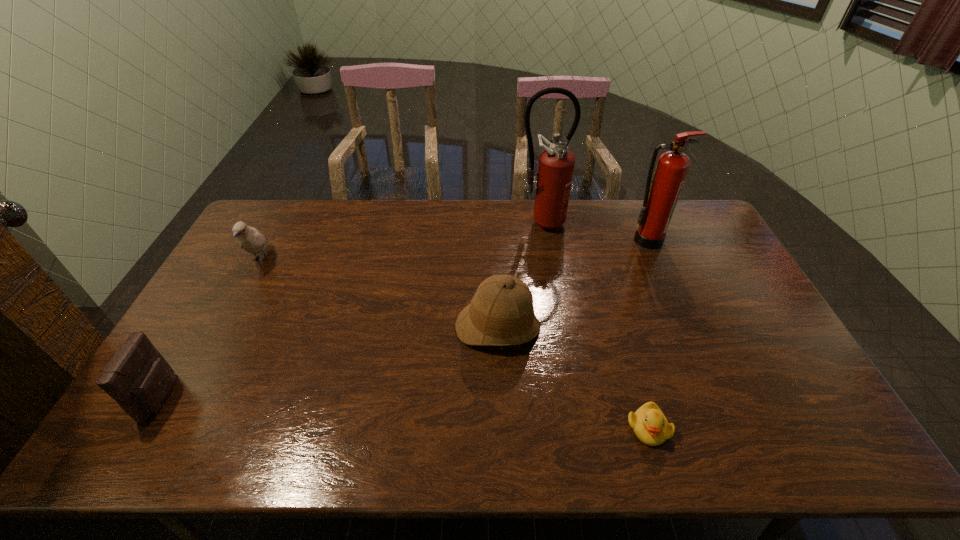
Image resolution: width=960 pixels, height=540 pixels. Identify the location of vacant space at the near edge of the desktop. (323, 431).

This screenshot has height=540, width=960. In order to click on free space at the left edge of the desktop in this screenshot , I will do `click(252, 268)`.

In the image, there is a desktop. Where is `free space at the far left corner`? free space at the far left corner is located at coordinates (270, 199).

This screenshot has width=960, height=540. Identify the location of free space at the far right corner of the desktop. (674, 225).

Where is `vacant area that lies between the duckling and the leftmost object`? The height and width of the screenshot is (540, 960). vacant area that lies between the duckling and the leftmost object is located at coordinates point(405,412).

Where is `free space between the fifth object from right to left and the hat`? free space between the fifth object from right to left and the hat is located at coordinates (379, 294).

Locate an element on the screen. Image resolution: width=960 pixels, height=540 pixels. vacant point located between the bird and the leftmost object is located at coordinates (212, 328).

Find the location of `unoccupied area between the tallest object and the bird`. unoccupied area between the tallest object and the bird is located at coordinates click(x=400, y=241).

Locate an element on the screen. The image size is (960, 540). vacant space in between the bird and the fifth shortest object is located at coordinates (454, 250).

Locate an element on the screen. vacant space that's between the left fire extinguisher and the duckling is located at coordinates (594, 325).